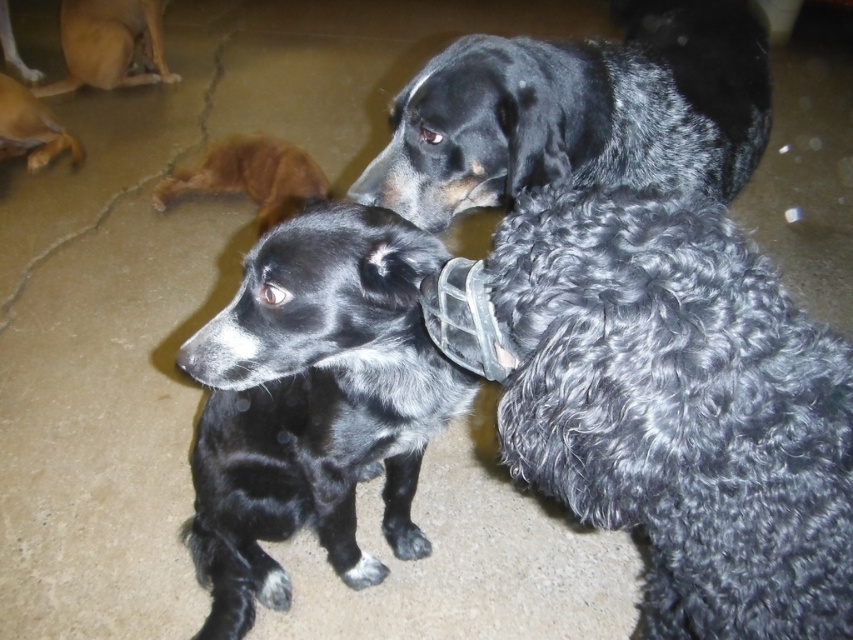
Is curly black fur at center taller than brown fur at upper left?

Yes, curly black fur at center is taller than brown fur at upper left.

Based on the photo, is curly black fur at center smaller than brown fur at upper left?

No, curly black fur at center is not smaller than brown fur at upper left.

This screenshot has width=853, height=640. In order to click on curly black fur at center in this screenshot , I will do `click(666, 403)`.

Does black fuzzy dog at center appear over brown fur at upper left?

Incorrect, black fuzzy dog at center is not positioned above brown fur at upper left.

Can you confirm if black fuzzy dog at center is positioned to the left of brown fur at upper left?

Incorrect, black fuzzy dog at center is not on the left side of brown fur at upper left.

Is point (375, 221) positioned before point (241, 148)?

Yes, point (375, 221) is in front of point (241, 148).

Locate an element on the screen. The width and height of the screenshot is (853, 640). black fuzzy dog at center is located at coordinates (312, 404).

Is point (279, 180) closer to viewer compared to point (27, 160)?

Yes.

Based on the photo, does brown fur at upper left lie in front of brown fur dog at upper left?

That is True.

Measure the distance between brown fur at upper left and camera.

brown fur at upper left and camera are 8.77 feet apart.

I want to click on brown fur at upper left, so click(x=250, y=177).